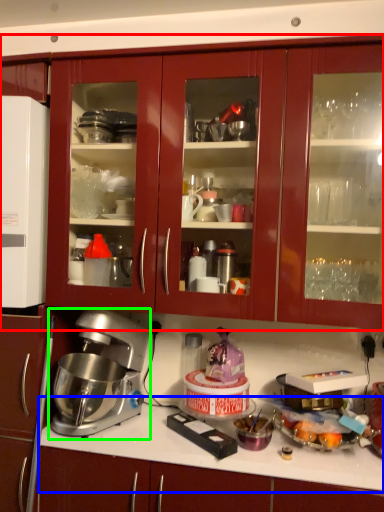
Question: Estimate the real-world distances between objects in this image. Which object is closer to cabinetry (highlighted by a red box), countertop (highlighted by a blue box) or mixer (highlighted by a green box)?

Choices:
 (A) countertop
 (B) mixer

Answer: (B)